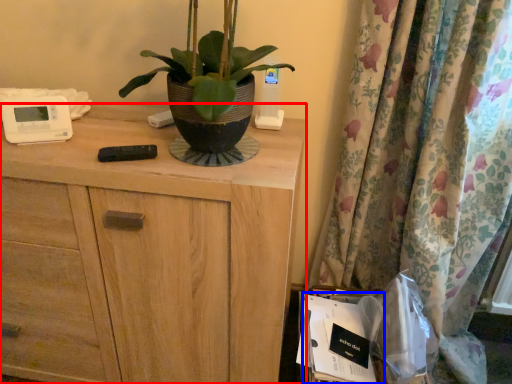
Question: Among these objects, which one is farthest to the camera, chest of drawers (highlighted by a red box) or paperback book (highlighted by a blue box)?

Choices:
 (A) chest of drawers
 (B) paperback book

Answer: (B)